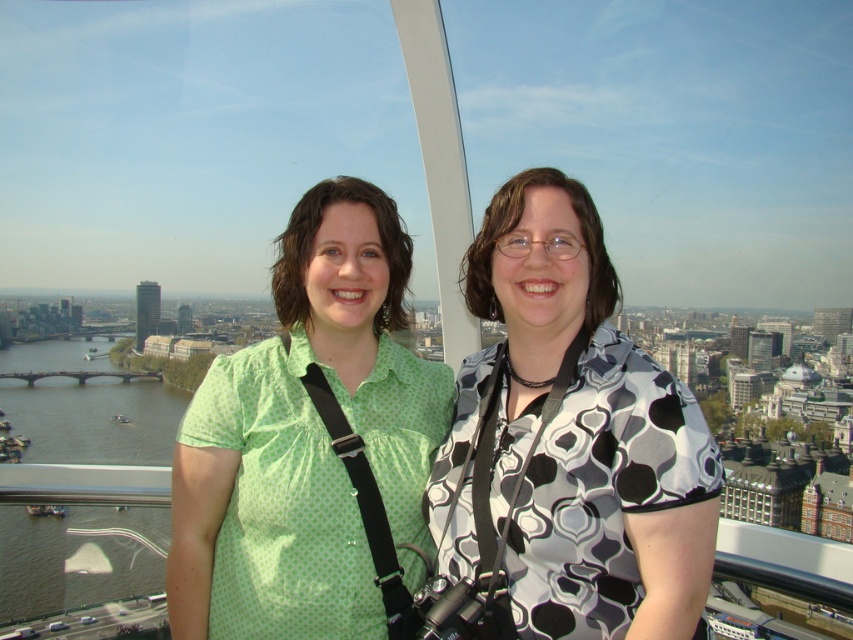
You are a photographer trying to capture a clear shot of the city skyline. You notice the green dotted shirt at center and the green water at lower left in your viewfinder. Which object should you focus on to ensure the city skyline is in the background?

To ensure the city skyline is in the background, focus on the green water at lower left because the green dotted shirt at center is in front of it, blocking the direct view of the skyline.